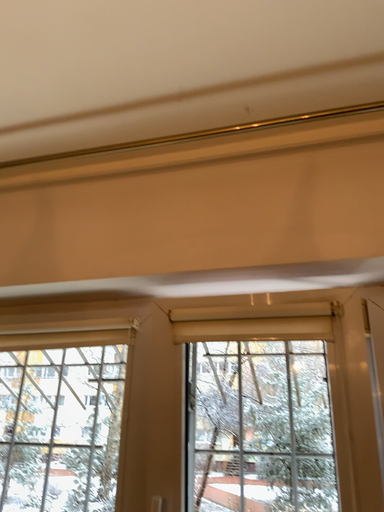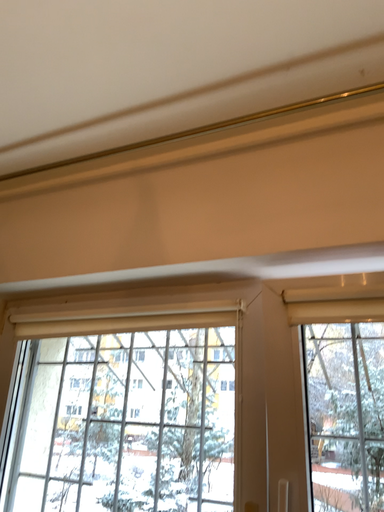
Question: How did the camera likely rotate when shooting the video?

Choices:
 (A) rotated right
 (B) rotated left

Answer: (B)